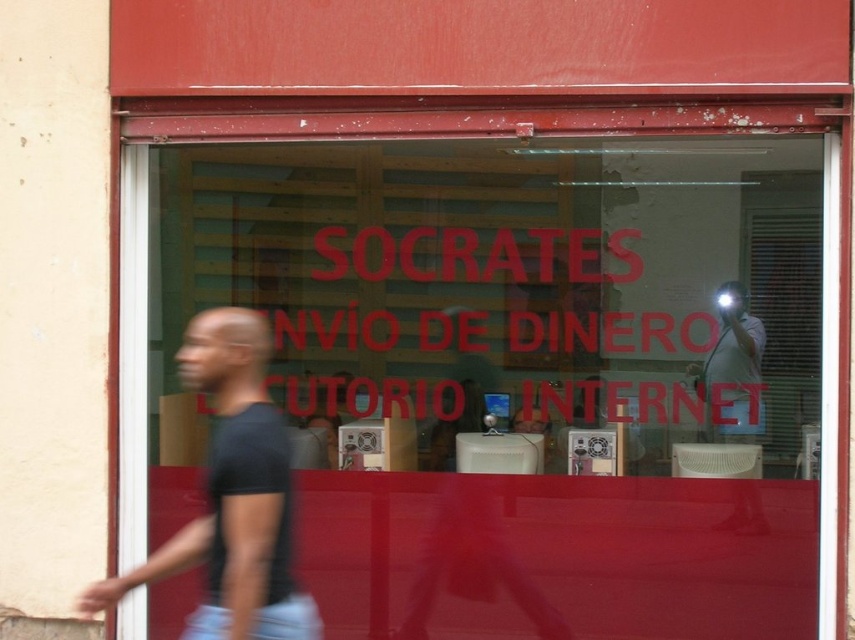
Can you confirm if black matte shirt at left is wider than white glossy camera at upper right?

Indeed, black matte shirt at left has a greater width compared to white glossy camera at upper right.

Who is positioned more to the right, black matte shirt at left or white glossy camera at upper right?

Positioned to the right is white glossy camera at upper right.

Image resolution: width=855 pixels, height=640 pixels. I want to click on black matte shirt at left, so click(233, 497).

At what (x,y) coordinates should I click in order to perform the action: click on black matte shirt at left. Please return your answer as a coordinate pair (x, y). This screenshot has width=855, height=640. Looking at the image, I should click on (233, 497).